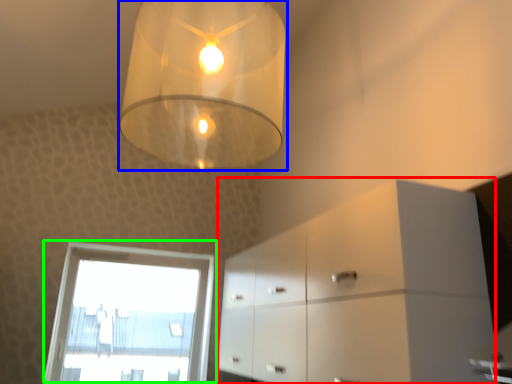
Question: Considering the real-world distances, which object is farthest from dresser (highlighted by a red box)? lamp (highlighted by a blue box) or window (highlighted by a green box)?

Choices:
 (A) lamp
 (B) window

Answer: (B)